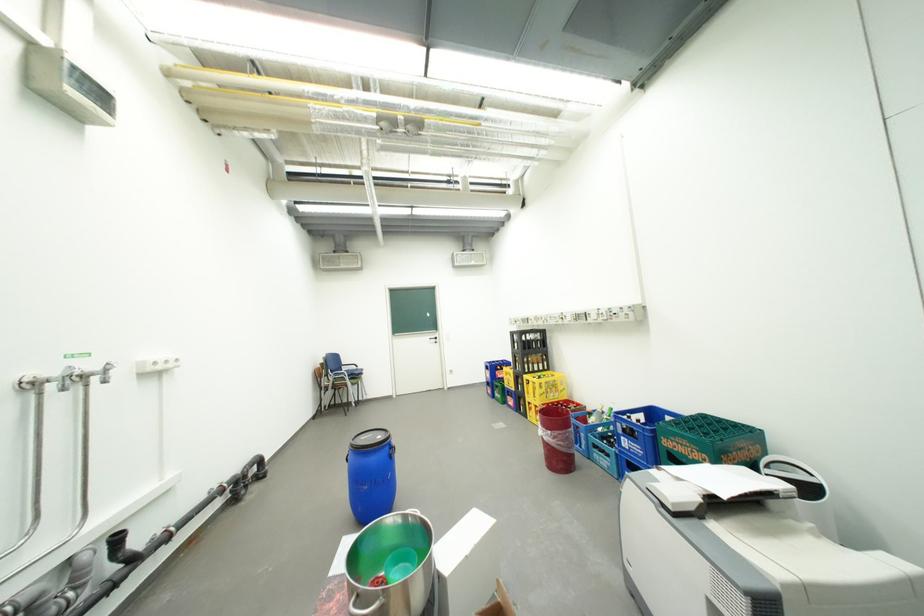
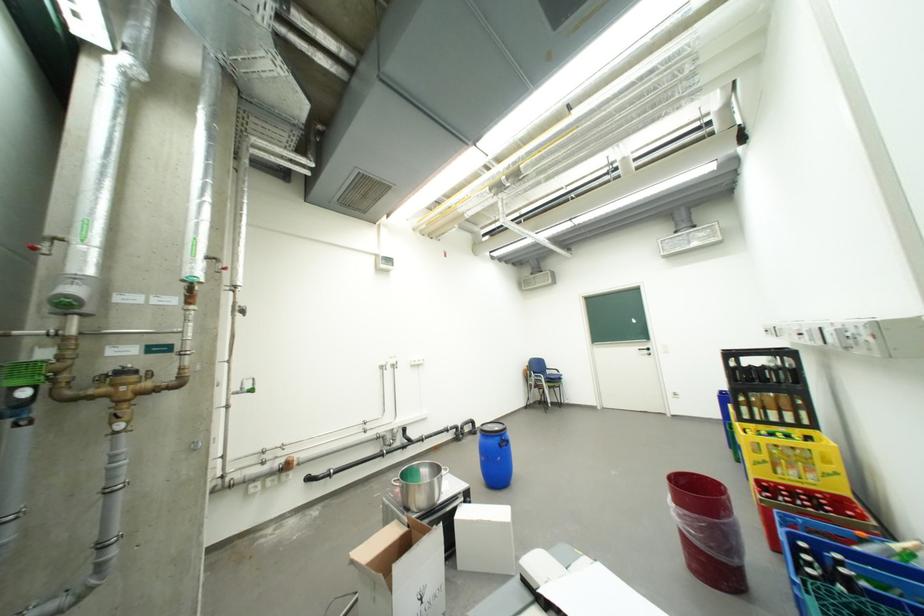
In the second image, find the point that corresponds to point (441, 339) in the first image.

(650, 351)